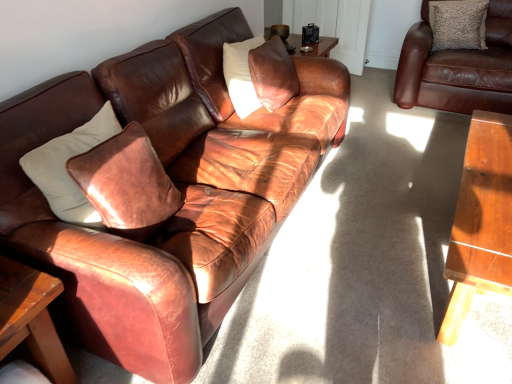
Question: Is brown leather couch at upper right, the first studio couch positioned from the right, positioned beyond the bounds of textured beige pillow at upper right, the second pillow from the front?

Choices:
 (A) yes
 (B) no

Answer: (A)

Question: From a real-world perspective, is brown leather couch at upper right, which is counted as the second studio couch, starting from the left, physically below textured beige pillow at upper right, which is counted as the first pillow, starting from the back?

Choices:
 (A) yes
 (B) no

Answer: (A)

Question: Could you tell me if brown leather couch at upper right, the first studio couch positioned from the right, is facing textured beige pillow at upper right, which ranks as the 2th pillow in left-to-right order?

Choices:
 (A) yes
 (B) no

Answer: (A)

Question: Is the depth of brown leather couch at upper right, which is counted as the second studio couch, starting from the left, less than that of textured beige pillow at upper right, the second pillow from the front?

Choices:
 (A) no
 (B) yes

Answer: (B)

Question: Considering the relative sizes of brown leather couch at upper right, the first studio couch positioned from the right, and textured beige pillow at upper right, the second pillow from the front, in the image provided, is brown leather couch at upper right, the first studio couch positioned from the right, smaller than textured beige pillow at upper right, the second pillow from the front,?

Choices:
 (A) yes
 (B) no

Answer: (B)

Question: Is textured beige pillow at upper right, marked as the 2th pillow in a bottom-to-top arrangement, completely or partially inside brown leather couch at upper right, which is counted as the second studio couch, starting from the left?

Choices:
 (A) yes
 (B) no

Answer: (A)

Question: From the image's perspective, is wooden table at lower left over matte brown leather couch at left, marked as the 1th studio couch in a left-to-right arrangement?

Choices:
 (A) yes
 (B) no

Answer: (B)

Question: Can you confirm if wooden table at lower left is thinner than matte brown leather couch at left, marked as the 1th studio couch in a left-to-right arrangement?

Choices:
 (A) no
 (B) yes

Answer: (B)

Question: From the image's perspective, is wooden table at lower left under matte brown leather couch at left, marked as the 1th studio couch in a left-to-right arrangement?

Choices:
 (A) yes
 (B) no

Answer: (A)

Question: Is wooden table at lower left looking in the opposite direction of matte brown leather couch at left, which is the 2th studio couch in right-to-left order?

Choices:
 (A) no
 (B) yes

Answer: (A)

Question: Are wooden table at lower left and matte brown leather couch at left, marked as the 1th studio couch in a left-to-right arrangement, beside each other?

Choices:
 (A) no
 (B) yes

Answer: (A)

Question: From a real-world perspective, is wooden table at lower left on matte brown leather couch at left, which is the 2th studio couch in right-to-left order?

Choices:
 (A) no
 (B) yes

Answer: (A)

Question: From the image's perspective, is leather pillow at center, the first pillow in the front-to-back sequence, above brown leather couch at upper right, which is counted as the second studio couch, starting from the left?

Choices:
 (A) yes
 (B) no

Answer: (B)